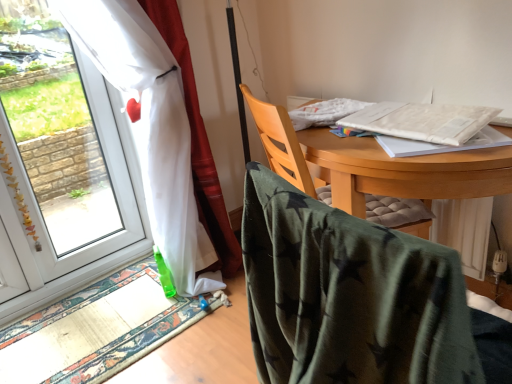
Find the location of a particular element. This screenshot has height=384, width=512. vacant space situated above green fabric mat at lower left (from a real-world perspective) is located at coordinates (75, 320).